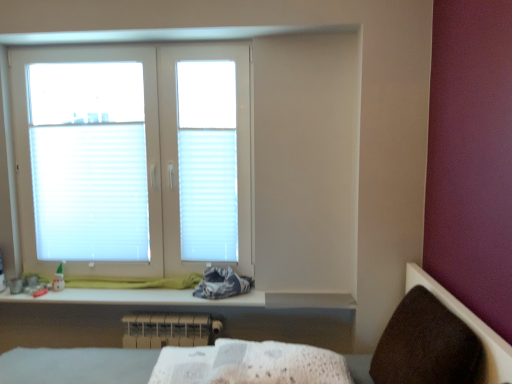
Question: Can you confirm if white textured fabric at lower center is shorter than white pleated blind at upper left, acting as the 1th blind starting from the left?

Choices:
 (A) yes
 (B) no

Answer: (A)

Question: Is white textured fabric at lower center not within white pleated blind at upper left, acting as the 1th blind starting from the left?

Choices:
 (A) yes
 (B) no

Answer: (A)

Question: Is white textured fabric at lower center far away from white pleated blind at upper left, acting as the 1th blind starting from the left?

Choices:
 (A) yes
 (B) no

Answer: (A)

Question: Is white textured fabric at lower center to the right of white pleated blind at upper left, which is the 2th blind in right-to-left order, from the viewer's perspective?

Choices:
 (A) no
 (B) yes

Answer: (B)

Question: Does white textured fabric at lower center have a greater width compared to white pleated blind at upper left, which is the 2th blind in right-to-left order?

Choices:
 (A) yes
 (B) no

Answer: (A)

Question: Visually, is brown fabric armchair at lower right positioned to the left or to the right of white glossy changing table at lower center?

Choices:
 (A) right
 (B) left

Answer: (A)

Question: Is point (418, 372) positioned closer to the camera than point (140, 304)?

Choices:
 (A) closer
 (B) farther

Answer: (A)

Question: From a real-world perspective, is brown fabric armchair at lower right above or below white glossy changing table at lower center?

Choices:
 (A) above
 (B) below

Answer: (A)

Question: From their relative heights in the image, would you say brown fabric armchair at lower right is taller or shorter than white glossy changing table at lower center?

Choices:
 (A) short
 (B) tall

Answer: (B)

Question: In terms of height, does brown fabric armchair at lower right look taller or shorter compared to white plastic window at upper left?

Choices:
 (A) tall
 (B) short

Answer: (B)

Question: Is brown fabric armchair at lower right spatially inside white plastic window at upper left, or outside of it?

Choices:
 (A) inside
 (B) outside

Answer: (B)

Question: In terms of size, does brown fabric armchair at lower right appear bigger or smaller than white plastic window at upper left?

Choices:
 (A) small
 (B) big

Answer: (A)

Question: Relative to white plastic window at upper left, is brown fabric armchair at lower right in front or behind?

Choices:
 (A) front
 (B) behind

Answer: (A)

Question: From the image's perspective, is white plastic radiator at lower center above or below white pleated blind at upper left, which is the 2th blind in right-to-left order?

Choices:
 (A) above
 (B) below

Answer: (B)

Question: Is white plastic radiator at lower center inside or outside of white pleated blind at upper left, acting as the 1th blind starting from the left?

Choices:
 (A) inside
 (B) outside

Answer: (B)